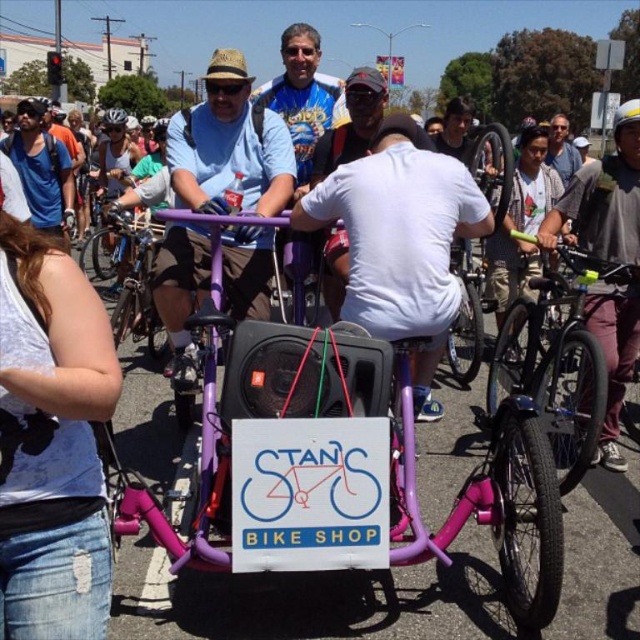
Question: Among these objects, which one is nearest to the camera?

Choices:
 (A) black matte bicycle helmet at upper left
 (B) matte blue shirt at left
 (C) matte purple bicycle at center

Answer: (C)

Question: Which point appears closest to the camera in this image?

Choices:
 (A) (237, 296)
 (B) (627, 102)
 (C) (145, 120)

Answer: (A)

Question: Considering the relative positions of matte gray shirt at center and white matte bicycle helmet at upper right in the image provided, where is matte gray shirt at center located with respect to white matte bicycle helmet at upper right?

Choices:
 (A) above
 (B) below

Answer: (A)

Question: Does maroon fabric helmet at upper right have a greater width compared to purple matte bicycle at center?

Choices:
 (A) yes
 (B) no

Answer: (B)

Question: Can you confirm if maroon fabric helmet at upper right is positioned above matte black helmet at upper left?

Choices:
 (A) yes
 (B) no

Answer: (B)

Question: Which point is closer to the camera?

Choices:
 (A) click(627, 113)
 (B) click(561, 170)
 (C) click(38, 108)
 (D) click(145, 125)

Answer: (A)